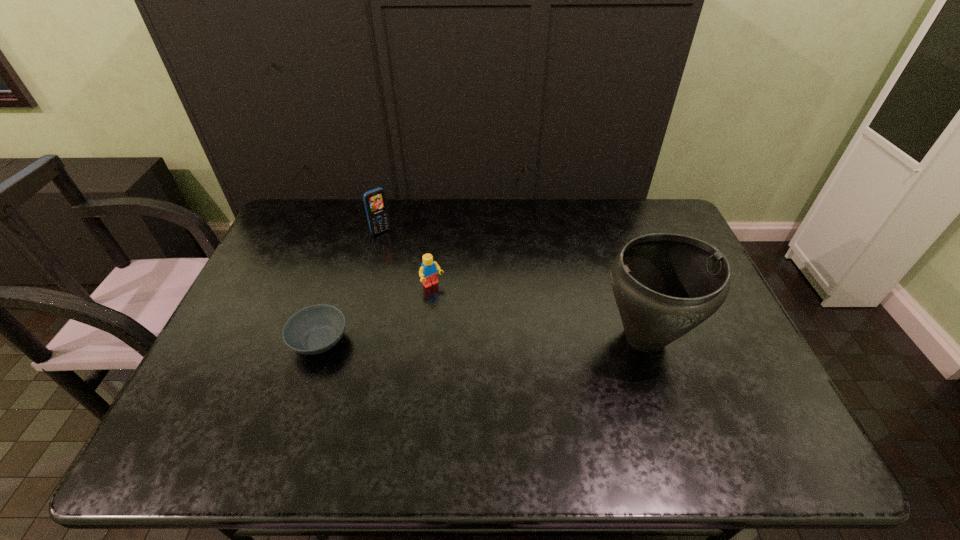
At what (x,y) coordinates should I click in order to perform the action: click on vacant area at the far left corner of the desktop. Please return your answer as a coordinate pair (x, y). Looking at the image, I should click on (310, 226).

At what (x,y) coordinates should I click in order to perform the action: click on free area in between the tallest object and the shortest object. Please return your answer as a coordinate pair (x, y). Image resolution: width=960 pixels, height=540 pixels. Looking at the image, I should click on (482, 339).

I want to click on free point between the third object from left to right and the second tallest object, so click(x=407, y=259).

Find the location of `vacant space that is in between the soup bowl and the tallest object`. vacant space that is in between the soup bowl and the tallest object is located at coordinates coord(482,339).

Locate an element on the screen. Image resolution: width=960 pixels, height=540 pixels. empty space that is in between the third nearest object and the farthest object is located at coordinates (407, 259).

You are a GUI agent. You are given a task and a screenshot of the screen. Output one action in this format:
    pyautogui.click(x=<x>, y=<y>)
    Task: Click on the blank region between the urn and the second farthest object
    This screenshot has width=960, height=540.
    Given the screenshot: What is the action you would take?
    pyautogui.click(x=539, y=312)

The image size is (960, 540). I want to click on vacant space that is in between the second object from right to left and the farthest object, so click(x=407, y=259).

Where is `free area in between the tallest object and the farthest object`? The height and width of the screenshot is (540, 960). free area in between the tallest object and the farthest object is located at coordinates (513, 285).

The image size is (960, 540). Find the location of `free space that is in between the urn and the shortest object`. free space that is in between the urn and the shortest object is located at coordinates (x=482, y=339).

Find the location of `unoccupied position between the third nearest object and the farthest object`. unoccupied position between the third nearest object and the farthest object is located at coordinates (407, 259).